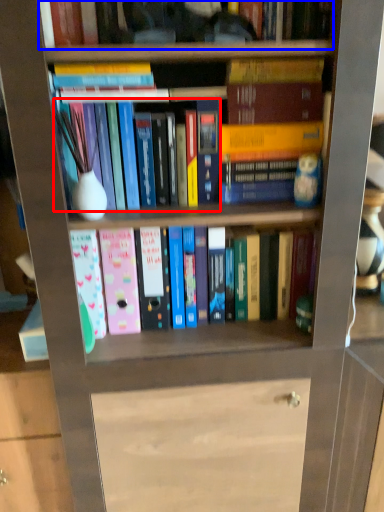
Question: Which of the following is the farthest to the observer, book (highlighted by a red box) or book (highlighted by a blue box)?

Choices:
 (A) book
 (B) book

Answer: (A)